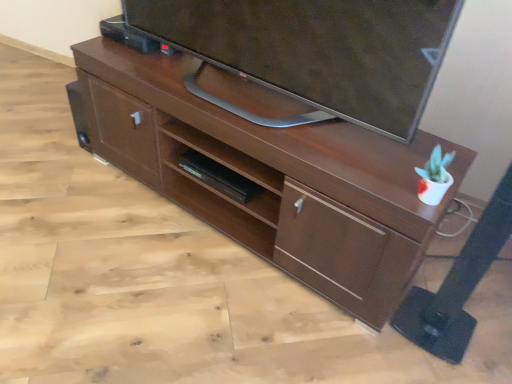
Question: Considering the positions of matte black tv at upper center and brown wood desk at center in the image, is matte black tv at upper center bigger or smaller than brown wood desk at center?

Choices:
 (A) big
 (B) small

Answer: (B)

Question: Would you say matte black tv at upper center is to the left or to the right of brown wood desk at center in the picture?

Choices:
 (A) left
 (B) right

Answer: (B)

Question: Which object is positioned farthest from the matte black tv at upper center?

Choices:
 (A) brown wood desk at center
 (B) black matte shelf at center

Answer: (B)

Question: Based on their relative distances, which object is farther from the matte black tv at upper center?

Choices:
 (A) brown wood desk at center
 (B) black matte shelf at center

Answer: (B)